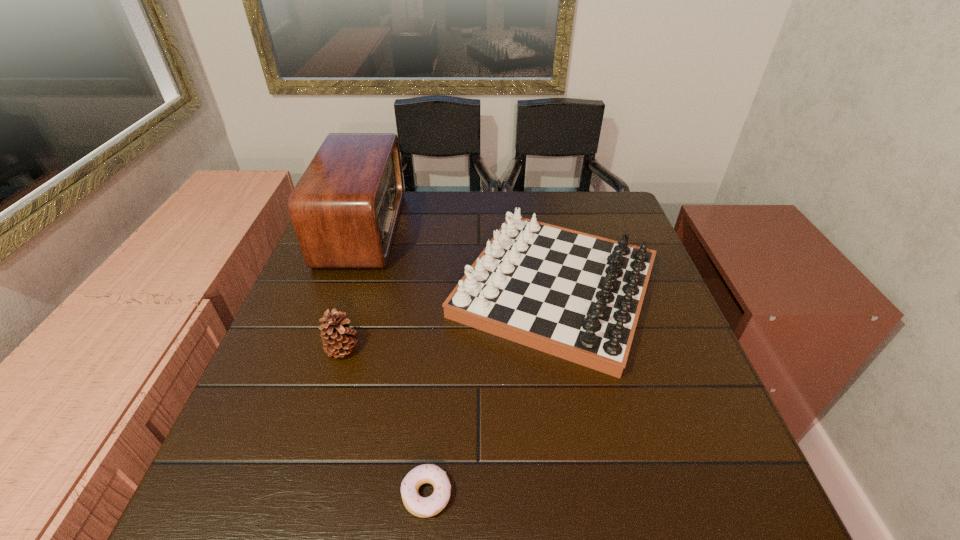
Find the location of a particular element. the tallest object is located at coordinates (345, 208).

You are a GUI agent. You are given a task and a screenshot of the screen. Output one action in this format:
    pyautogui.click(x=<x>, y=<y>)
    Task: Click on the gameboard
    
    Given the screenshot: What is the action you would take?
    pyautogui.click(x=577, y=296)

You are a GUI agent. You are given a task and a screenshot of the screen. Output one action in this format:
    pyautogui.click(x=<x>, y=<y>)
    Task: Click on the pinecone
    The height and width of the screenshot is (540, 960).
    Given the screenshot: What is the action you would take?
    pyautogui.click(x=337, y=340)

This screenshot has height=540, width=960. I want to click on the shortest object, so click(423, 507).

Locate an element on the screen. This screenshot has height=540, width=960. doughnut is located at coordinates (423, 507).

Where is `blank space located 0.370m on the front panel of the tallest object`? blank space located 0.370m on the front panel of the tallest object is located at coordinates (520, 228).

Where is `free space located on the back of the gameboard`? free space located on the back of the gameboard is located at coordinates (538, 198).

The image size is (960, 540). What are the coordinates of `vacant area situated on the right of the pinecone` in the screenshot? It's located at (392, 349).

I want to click on free space located on the right of the doughnut, so click(612, 494).

You are a GUI agent. You are given a task and a screenshot of the screen. Output one action in this format:
    pyautogui.click(x=<x>, y=<y>)
    Task: Click on the radio receiver at the far edge
    
    Given the screenshot: What is the action you would take?
    pyautogui.click(x=345, y=208)